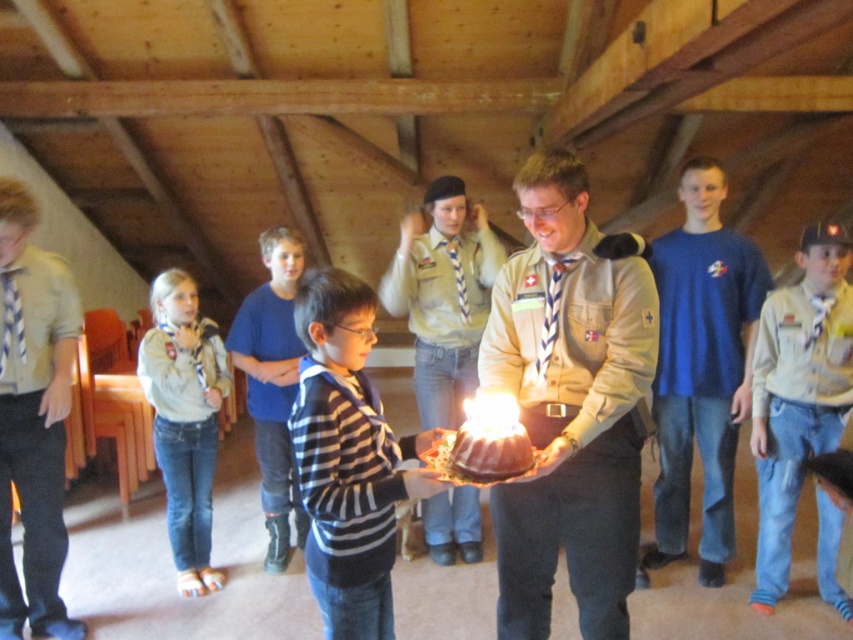
You are at a birthday party in a rustic wooden building. You see a matte khaki uniform at center and denim jeans at lower right. Which one is higher up?

The matte khaki uniform at center is above denim jeans at lower right, so the matte khaki uniform at center is higher up.